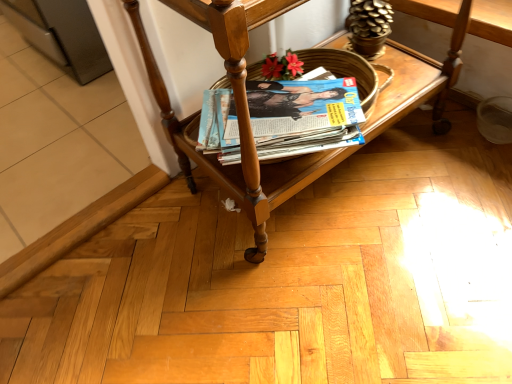
Question: From a real-world perspective, is matte paper magazine at center below wooden magazine rack at center?

Choices:
 (A) no
 (B) yes

Answer: (B)

Question: Does matte paper magazine at center have a lesser width compared to wooden magazine rack at center?

Choices:
 (A) no
 (B) yes

Answer: (B)

Question: Does matte paper magazine at center lie in front of wooden magazine rack at center?

Choices:
 (A) yes
 (B) no

Answer: (B)

Question: Can we say matte paper magazine at center lies outside wooden magazine rack at center?

Choices:
 (A) yes
 (B) no

Answer: (B)

Question: Does matte paper magazine at center turn towards wooden magazine rack at center?

Choices:
 (A) no
 (B) yes

Answer: (B)

Question: Can you confirm if matte paper magazine at center is shorter than wooden magazine rack at center?

Choices:
 (A) yes
 (B) no

Answer: (A)

Question: Could matte paper magazine at center be considered to be inside wooden magazine rack at center?

Choices:
 (A) no
 (B) yes

Answer: (B)

Question: Does wooden magazine rack at center have a greater height compared to matte paper magazine at center?

Choices:
 (A) yes
 (B) no

Answer: (A)

Question: Can you confirm if wooden magazine rack at center is wider than matte paper magazine at center?

Choices:
 (A) yes
 (B) no

Answer: (A)

Question: Is wooden magazine rack at center at the right side of matte paper magazine at center?

Choices:
 (A) yes
 (B) no

Answer: (A)

Question: From the image's perspective, is wooden magazine rack at center on matte paper magazine at center?

Choices:
 (A) no
 (B) yes

Answer: (B)

Question: Is wooden magazine rack at center not close to matte paper magazine at center?

Choices:
 (A) yes
 (B) no

Answer: (B)

Question: Looking at the image, does matte paper magazine at center seem bigger or smaller compared to wooden magazine rack at center?

Choices:
 (A) big
 (B) small

Answer: (B)